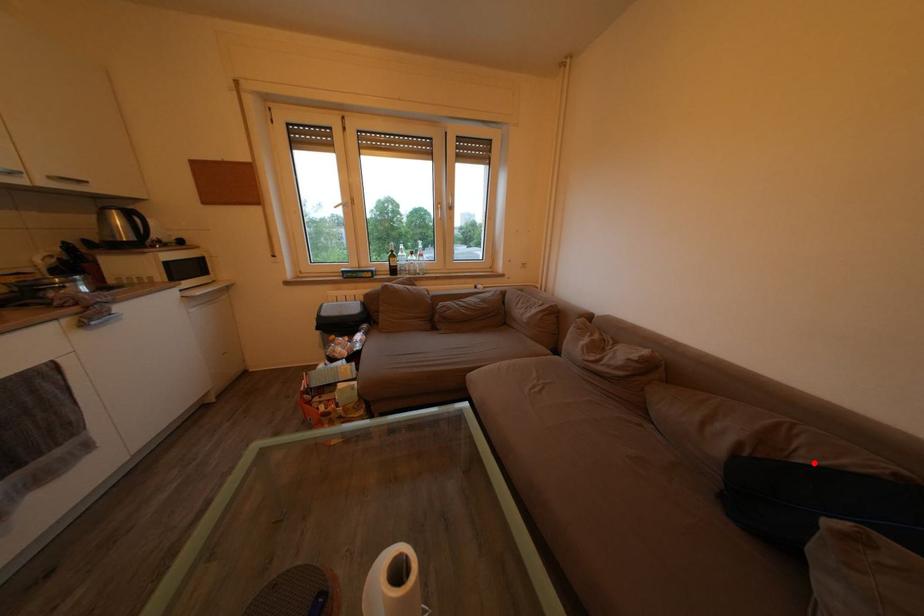
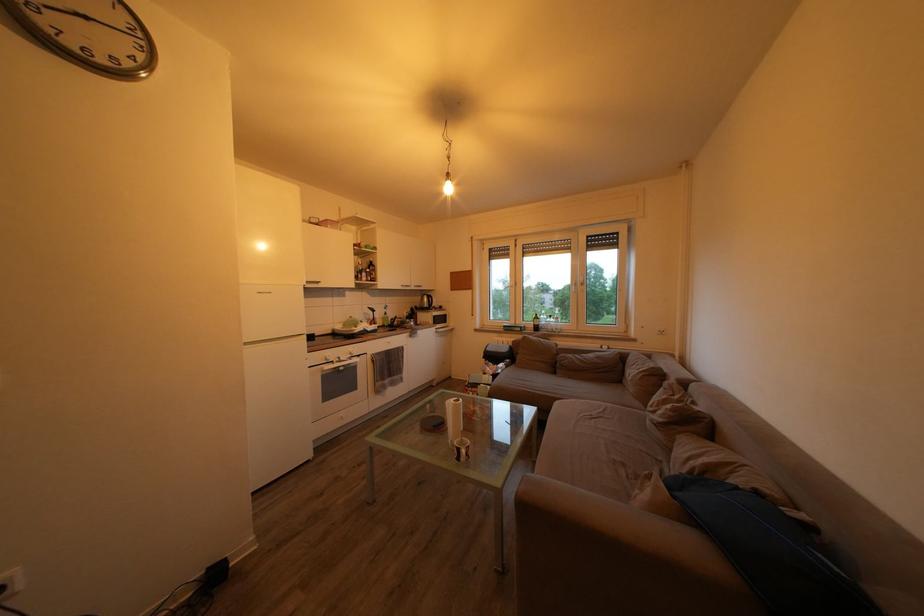
Where in the second image is the point corresponding to the highlighted location from the first image?

(736, 488)